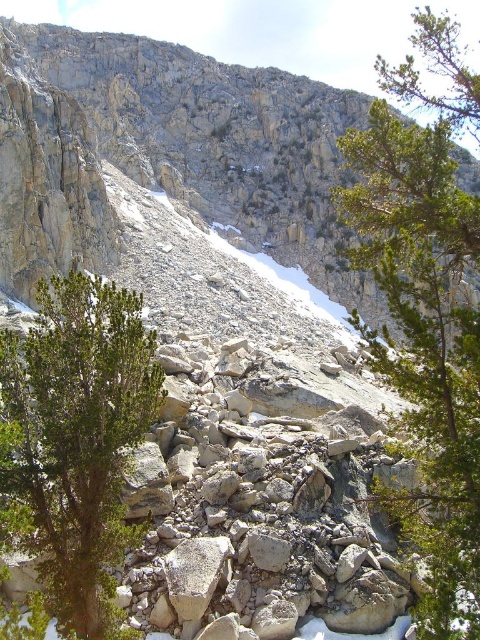
Describe the element at coordinates (167, 152) in the screenshot. Image resolution: width=480 pixels, height=640 pixels. I see `rough gray rock at center` at that location.

Can you confirm if rough gray rock at center is positioned to the left of green leafy shrub at left?

Correct, you'll find rough gray rock at center to the left of green leafy shrub at left.

Describe the element at coordinates (167, 152) in the screenshot. I see `rough gray rock at center` at that location.

Find the location of `rough gray rock at center`. rough gray rock at center is located at coordinates (167, 152).

Can you confirm if green leafy tree at center is positioned to the left of green leafy shrub at left?

No, green leafy tree at center is not to the left of green leafy shrub at left.

Does point (465, 198) lie in front of point (60, 348)?

No.

In order to click on green leafy tree at center in this screenshot , I will do `click(427, 314)`.

Does rough gray rock at center appear on the right side of green leafy tree at center?

In fact, rough gray rock at center is to the left of green leafy tree at center.

Find the location of a particular element. rough gray rock at center is located at coordinates (167, 152).